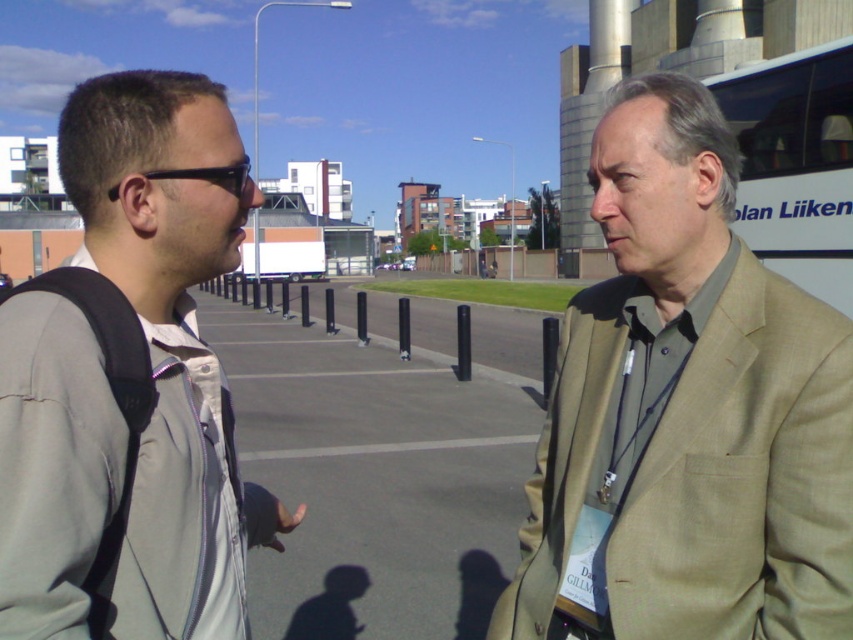
Question: Estimate the real-world distances between objects in this image. Which object is closer to the tan fabric suit at right?

Choices:
 (A) gray fabric jacket at left
 (B) black asphalt parking lot at center
 (C) black plastic goggles at left
 (D) white matte bus at right

Answer: (C)

Question: Which point is closer to the camera?

Choices:
 (A) (755, 141)
 (B) (210, 180)
 (C) (263, 560)

Answer: (B)

Question: Does tan fabric suit at right appear under white matte bus at right?

Choices:
 (A) yes
 (B) no

Answer: (A)

Question: Among these objects, which one is nearest to the camera?

Choices:
 (A) white matte bus at right
 (B) black plastic goggles at left
 (C) black asphalt parking lot at center
 (D) tan fabric suit at right

Answer: (B)

Question: Can you confirm if gray fabric jacket at left is smaller than black asphalt parking lot at center?

Choices:
 (A) no
 (B) yes

Answer: (B)

Question: Does white matte bus at right have a smaller size compared to black plastic goggles at left?

Choices:
 (A) yes
 (B) no

Answer: (B)